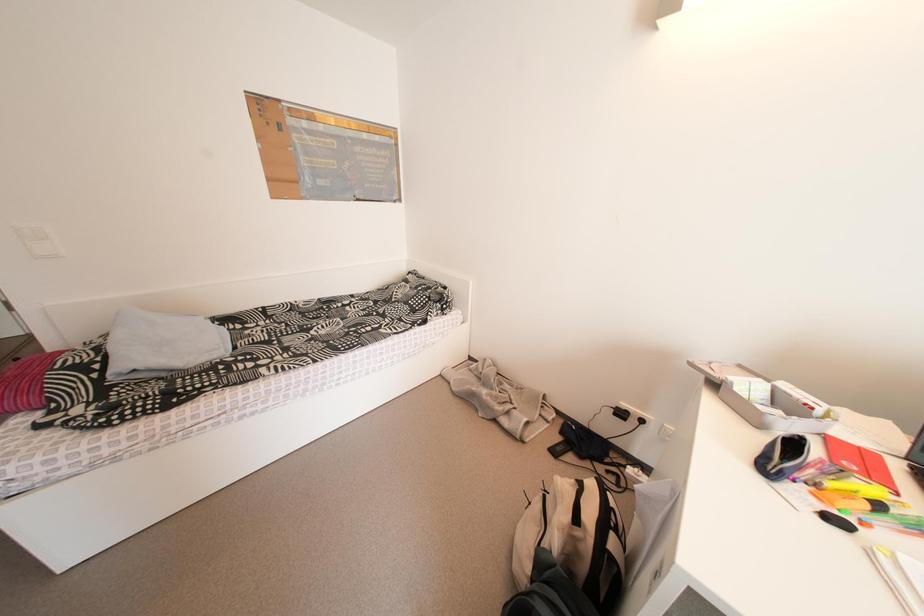
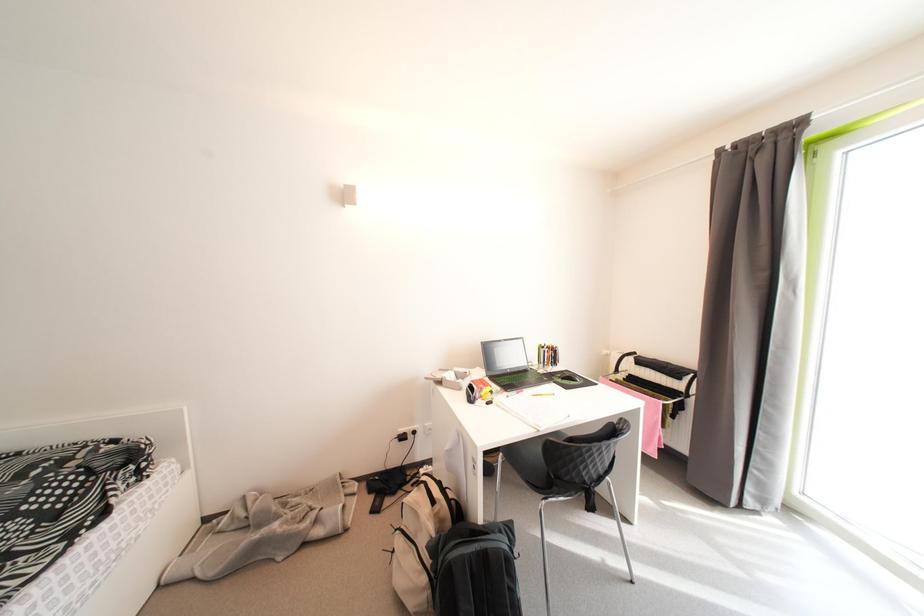
Question: The camera is either moving clockwise (left) or counter-clockwise (right) around the object. The first image is from the beginning of the video and the second image is from the end. Is the camera moving left or right when shooting the video?

Choices:
 (A) Left
 (B) Right

Answer: (A)